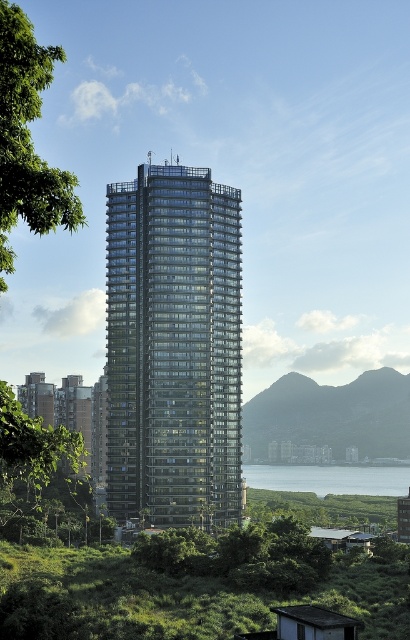
You are standing in front of the skyscraper and want to take a photo of the blue glass water at lower center without the green leafy tree at upper left blocking the view. Is this possible?

The green leafy tree at upper left is in front of the blue glass water at lower center, so it will block the view. To capture the blue glass water at lower center without obstruction, you would need to reposition yourself to an angle where the tree is not between you and the water.

You are a drone operator planning to fly a drone from the green leafy tree at upper left to the rocky gray hillside at center. The drone has a maximum flight range of 600 meters. Based on the scene, can the drone reach its destination without needing a recharge?

The green leafy tree at upper left and the rocky gray hillside at center are 613.99 meters apart from each other. Since the drone can only fly 600 meters before needing a recharge, it cannot reach the destination without recharging.